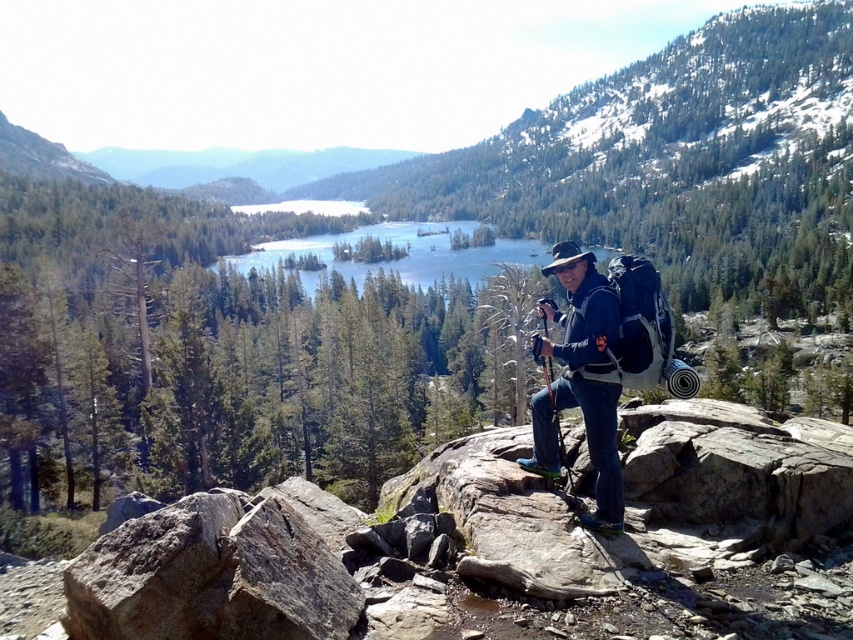
Is point (231, 262) positioned behind point (538, 314)?

Yes, it is.

Can you confirm if clear blue water at center is positioned below wooden cane at center?

Incorrect, clear blue water at center is not positioned below wooden cane at center.

Is point (416, 262) behind point (566, 492)?

Yes, it is behind point (566, 492).

Image resolution: width=853 pixels, height=640 pixels. In order to click on clear blue water at center in this screenshot , I will do `click(405, 252)`.

Is the position of gray rock at center more distant than that of matte blue jacket at center?

No, gray rock at center is closer to the viewer.

Is gray rock at center bigger than matte blue jacket at center?

Yes, gray rock at center is bigger than matte blue jacket at center.

At what (x,y) coordinates should I click in order to perform the action: click on gray rock at center. Please return your answer as a coordinate pair (x, y). Looking at the image, I should click on (611, 536).

You are a GUI agent. You are given a task and a screenshot of the screen. Output one action in this format:
    pyautogui.click(x=<x>, y=<y>)
    Task: Click on the gray rock at center
    This screenshot has height=640, width=853.
    Given the screenshot: What is the action you would take?
    pyautogui.click(x=611, y=536)

Is point (611, 445) positioned before point (553, 406)?

That is True.

The width and height of the screenshot is (853, 640). What do you see at coordinates (579, 380) in the screenshot?
I see `matte blue jacket at center` at bounding box center [579, 380].

Find the location of a particular element. This screenshot has height=640, width=853. matte blue jacket at center is located at coordinates (579, 380).